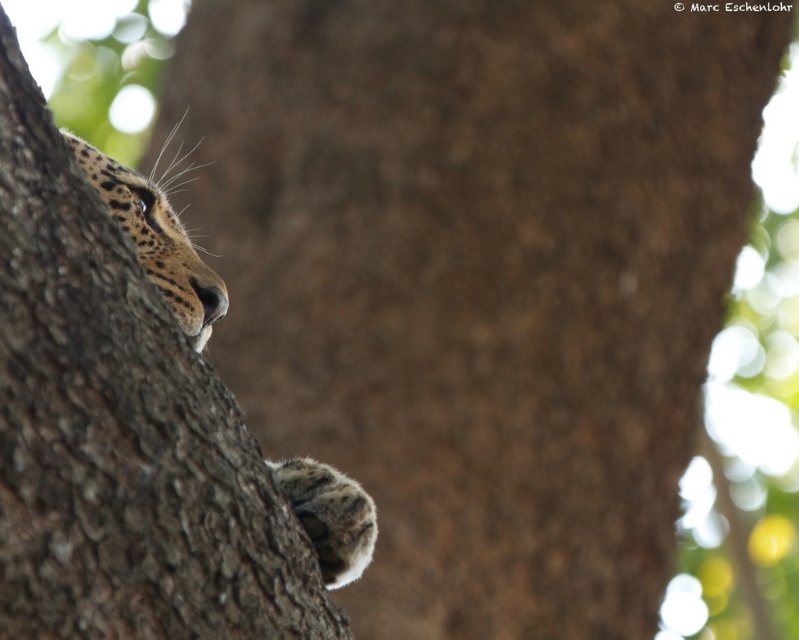
You are a wildlife photographer aiming to capture the leopard in the image. You want to ensure the entire spotted fur paw at lower center is visible without being blocked by the brown rough tree trunk at left. Based on the scene, can you determine if this is possible?

The brown rough tree trunk at left is taller than the spotted fur paw at lower center, so the trunk may block part of the paw. To ensure the entire paw is visible, adjust your angle to move around the tree trunk or zoom in closer to avoid obstruction.

You are a wildlife photographer trying to capture a clear shot of the leopard. The leopard is hiding behind the brown rough tree trunk at left and has its spotted fur paw at lower center visible. Since you want to focus on the leopard, which object should you adjust your camera focus to ensure the leopard is sharp while keeping the tree trunk slightly out of focus?

You should focus on the spotted fur paw at lower center because it is closer to the camera than the brown rough tree trunk at left, which is wider and further away. By focusing on the paw, the leopard will be sharp while the tree trunk remains slightly blurred.

You are a wildlife photographer holding a camera that requires you to be at least 1.5 meters away from the subject to avoid blurring. You see the brown rough tree trunk at left where a leopard is hiding. Can you take a clear photo of the leopard without moving closer?

The brown rough tree trunk at left is only 1.20 meters away from the viewer, which is less than the required 1.5 meters distance needed to avoid blurring. Therefore, you cannot take a clear photo of the leopard without moving closer.